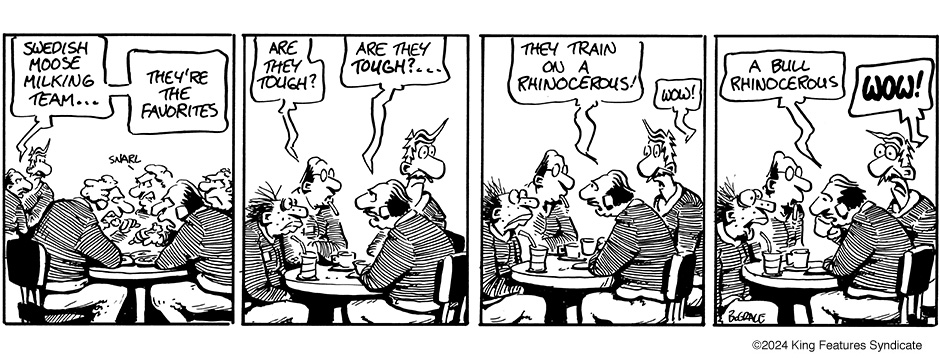
You are a GUI agent. You are given a task and a screenshot of the screen. Output one action in this format:
    pyautogui.click(x=<x>, y=<y>)
    Task: Click on the table top
    Image resolution: width=940 pixels, height=360 pixels.
    Given the screenshot: What is the action you would take?
    pyautogui.click(x=133, y=270), pyautogui.click(x=337, y=278), pyautogui.click(x=560, y=269), pyautogui.click(x=794, y=271)